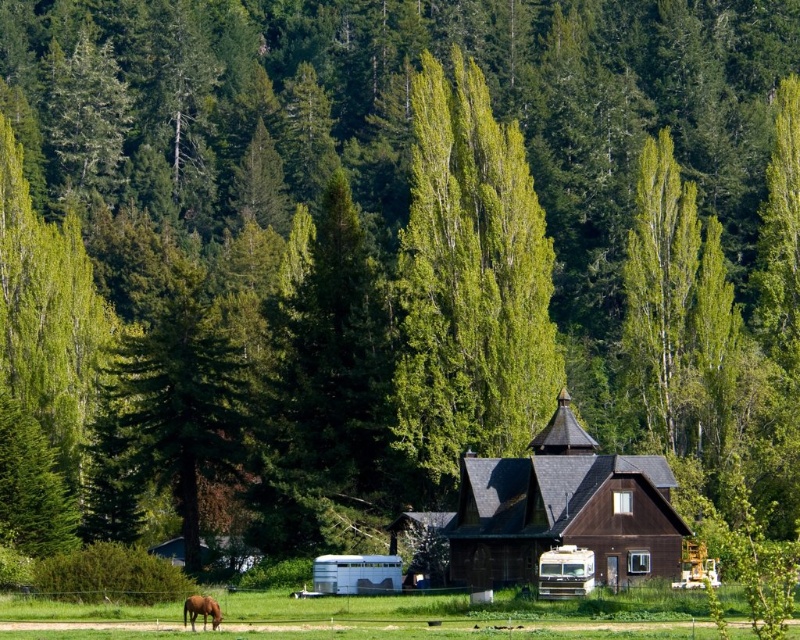
Question: Which point is closer to the camera?

Choices:
 (A) brown glossy horse at lower left
 (B) metallic silver recreational vehicle at center
 (C) brown wooden barn at center

Answer: (A)

Question: Which point appears closest to the camera in this image?

Choices:
 (A) (189, 384)
 (B) (500, 536)

Answer: (B)

Question: Considering the relative positions of green grass at lower center and brown glossy horse at lower left in the image provided, where is green grass at lower center located with respect to brown glossy horse at lower left?

Choices:
 (A) above
 (B) below

Answer: (A)

Question: Which object is positioned farthest from the metallic silver recreational vehicle at center?

Choices:
 (A) green grass at lower center
 (B) silver metallic trailer at center

Answer: (B)

Question: Is green leafy tree at center behind metallic silver recreational vehicle at center?

Choices:
 (A) yes
 (B) no

Answer: (A)

Question: Is metallic silver recreational vehicle at center positioned behind brown glossy horse at lower left?

Choices:
 (A) no
 (B) yes

Answer: (B)